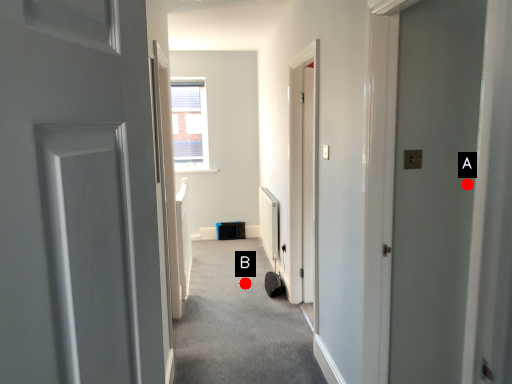
Question: Two points are circled on the image, labeled by A and B beside each circle. Which point appears farthest from the camera in this image?

Choices:
 (A) A is further
 (B) B is further

Answer: (B)